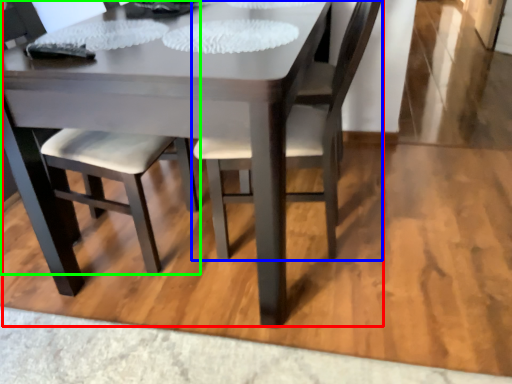
Question: Which is farther away from kitchen & dining room table (highlighted by a red box)? chair (highlighted by a blue box) or chair (highlighted by a green box)?

Choices:
 (A) chair
 (B) chair

Answer: (A)